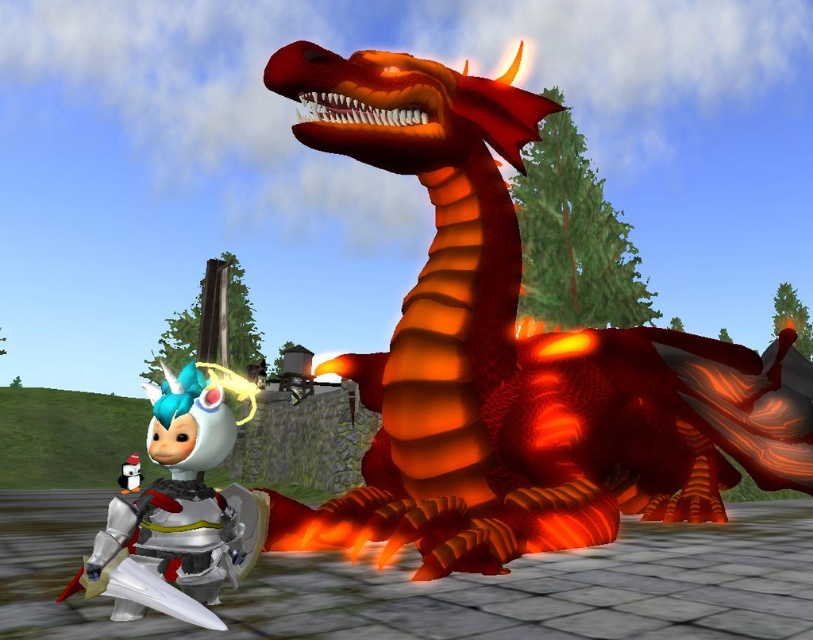
Who is positioned more to the left, shiny orange dragon at center or metallic silver armor at left?

metallic silver armor at left is more to the left.

Locate an element on the screen. The image size is (813, 640). shiny orange dragon at center is located at coordinates (516, 356).

I want to click on shiny orange dragon at center, so (x=516, y=356).